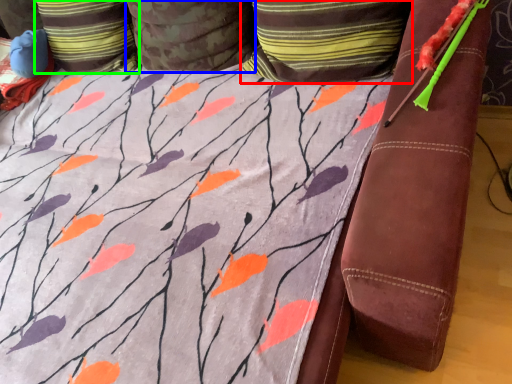
Question: Which is farther away from pillow (highlighted by a red box)? pillow (highlighted by a blue box) or pillow (highlighted by a green box)?

Choices:
 (A) pillow
 (B) pillow

Answer: (B)